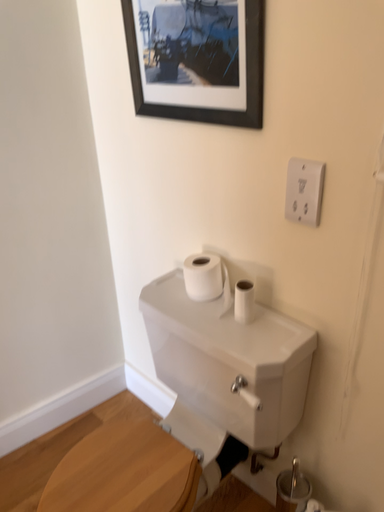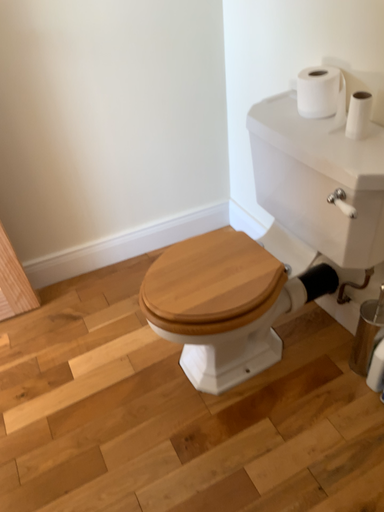
Question: How did the camera likely rotate when shooting the video?

Choices:
 (A) rotated right
 (B) rotated left

Answer: (B)